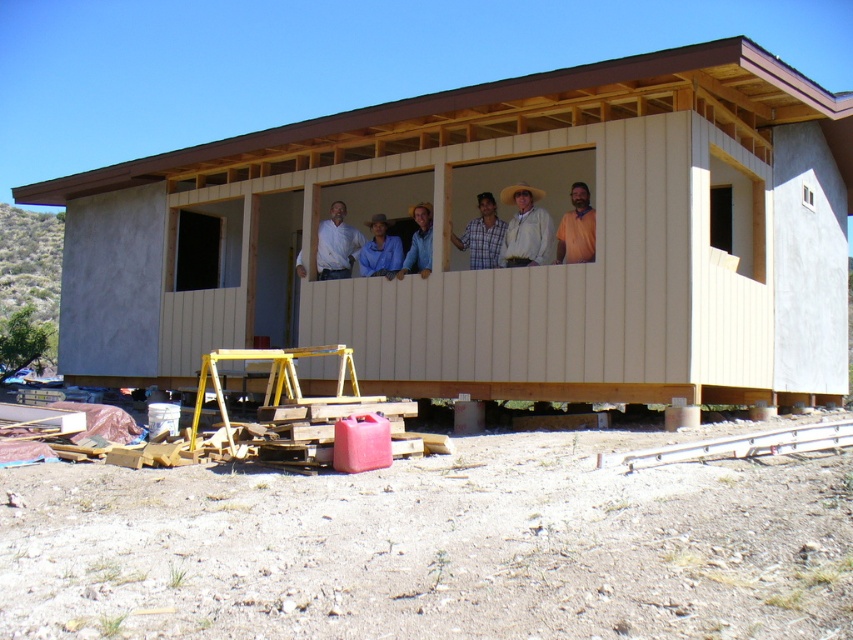
Question: Which point is closer to the camera taking this photo?

Choices:
 (A) (560, 260)
 (B) (206, 289)
 (C) (548, 214)

Answer: (A)

Question: Which of the following is the closest to the observer?

Choices:
 (A) (82, 323)
 (B) (480, 227)
 (C) (514, 244)

Answer: (C)

Question: Is white shirt at center bigger than brown shirt at center?

Choices:
 (A) yes
 (B) no

Answer: (A)

Question: Does white matte jacket at center come behind brown shirt at center?

Choices:
 (A) no
 (B) yes

Answer: (B)

Question: Can you confirm if beige wood cabin at center is positioned below white matte jacket at center?

Choices:
 (A) no
 (B) yes

Answer: (B)

Question: Based on their relative distances, which object is farther from the beige wood cabin at center?

Choices:
 (A) white shirt at center
 (B) plaid shirt at center
 (C) brown shirt at center
 (D) white matte jacket at center

Answer: (C)